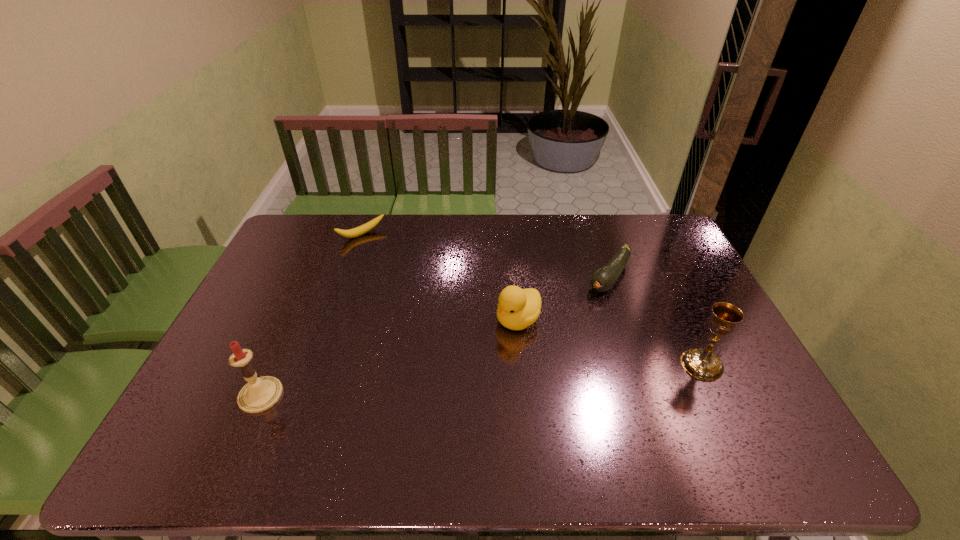
Identify the location of unoccupied area between the duck and the farthest object. This screenshot has width=960, height=540. (440, 277).

Where is `free spot between the farthest object and the candle`? The height and width of the screenshot is (540, 960). free spot between the farthest object and the candle is located at coordinates (311, 315).

At what (x,y) coordinates should I click in order to perform the action: click on free space between the zucchini and the farthest object. Please return your answer as a coordinate pair (x, y). The image size is (960, 540). Looking at the image, I should click on (486, 256).

Image resolution: width=960 pixels, height=540 pixels. Identify the location of free space that is in between the chalice and the zucchini. (656, 321).

In order to click on blank region between the farthest object and the third farthest object in this screenshot , I will do `click(440, 277)`.

Find the location of a particular element. vacant area that lies between the farthest object and the zucchini is located at coordinates (486, 256).

In order to click on free point between the farthest object and the candle in this screenshot , I will do `click(311, 315)`.

Identify which object is the third closest to the candle. Please provide its 2D coordinates. Your answer should be formatted as a tuple, i.e. [(x, y)], where the tuple contains the x and y coordinates of a point satisfying the conditions above.

[(605, 278)]

Where is `object that ranks as the fourth closest to the rightmost object`? The width and height of the screenshot is (960, 540). object that ranks as the fourth closest to the rightmost object is located at coordinates (260, 394).

Identify the location of free space that satisfies the following two spatial constraints: 1. on the back side of the candle; 2. on the right side of the fourth nearest object. Image resolution: width=960 pixels, height=540 pixels. (312, 277).